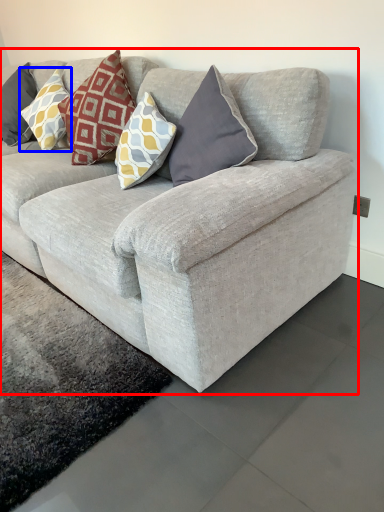
Question: Which of the following is the farthest to the observer, studio couch (highlighted by a red box) or pillow (highlighted by a blue box)?

Choices:
 (A) studio couch
 (B) pillow

Answer: (B)